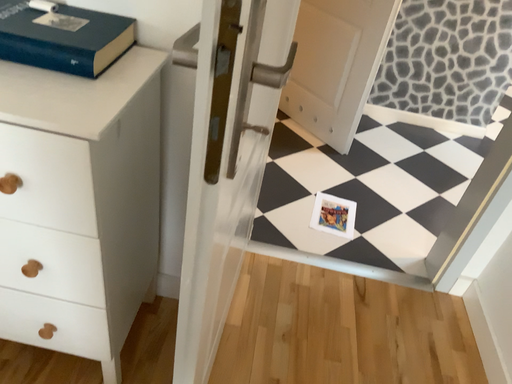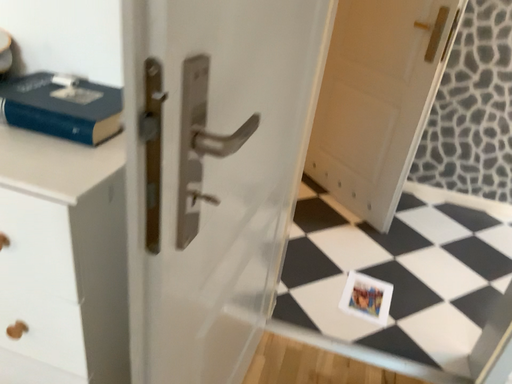
Question: Which way did the camera rotate in the video?

Choices:
 (A) rotated left
 (B) rotated right

Answer: (A)